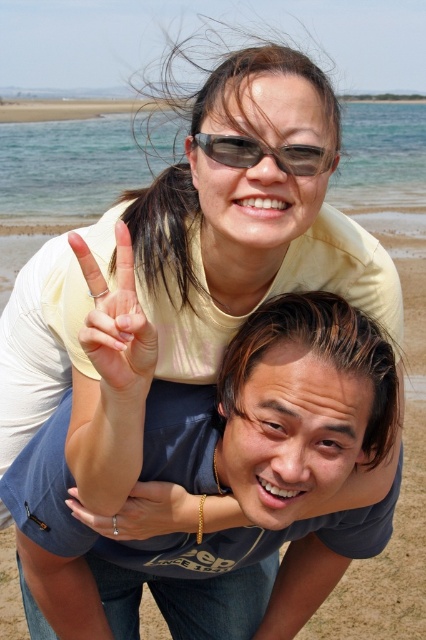
Based on the coordinates provided, which object is located at point (224, 477)?

The point (224, 477) indicates the blue cotton shirt at center.